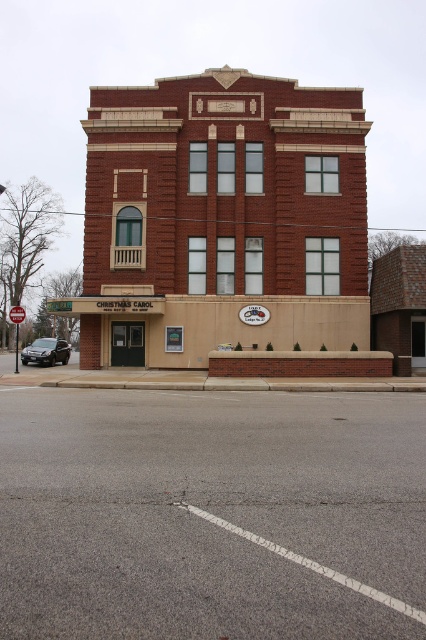
I want to click on satin black sedan at lower left, so click(x=46, y=352).

Is satin black sedan at lower left taller than brushed metal stop sign at upper center?

Indeed, satin black sedan at lower left has a greater height compared to brushed metal stop sign at upper center.

What do you see at coordinates (46, 352) in the screenshot? This screenshot has width=426, height=640. I see `satin black sedan at lower left` at bounding box center [46, 352].

Locate an element on the screen. satin black sedan at lower left is located at coordinates (46, 352).